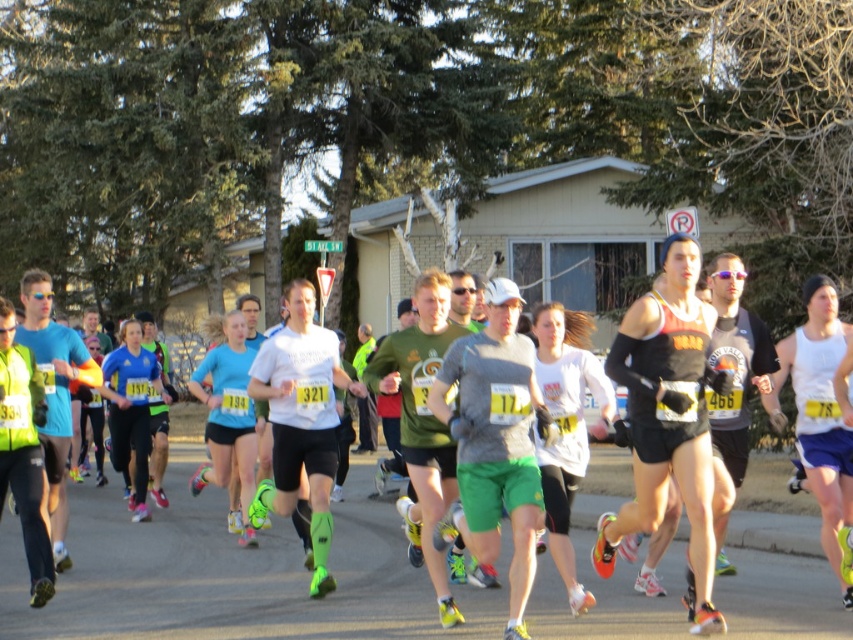
Which is in front, point (212, 502) or point (807, 378)?

Point (807, 378) is in front.

Is gray matte shirt at center smaller than white fabric tank top at center?

Actually, gray matte shirt at center might be larger than white fabric tank top at center.

Find the location of a particular element. The width and height of the screenshot is (853, 640). gray matte shirt at center is located at coordinates (231, 577).